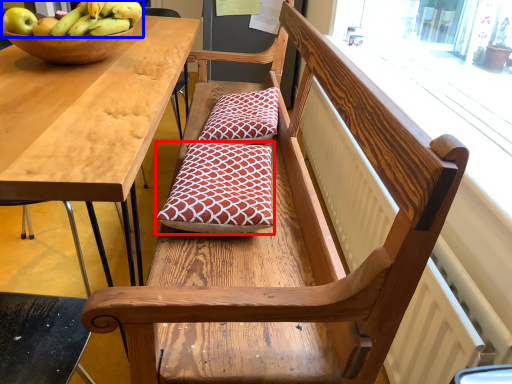
Question: Among these objects, which one is farthest to the camera, pillow (highlighted by a red box) or banana (highlighted by a blue box)?

Choices:
 (A) pillow
 (B) banana

Answer: (A)